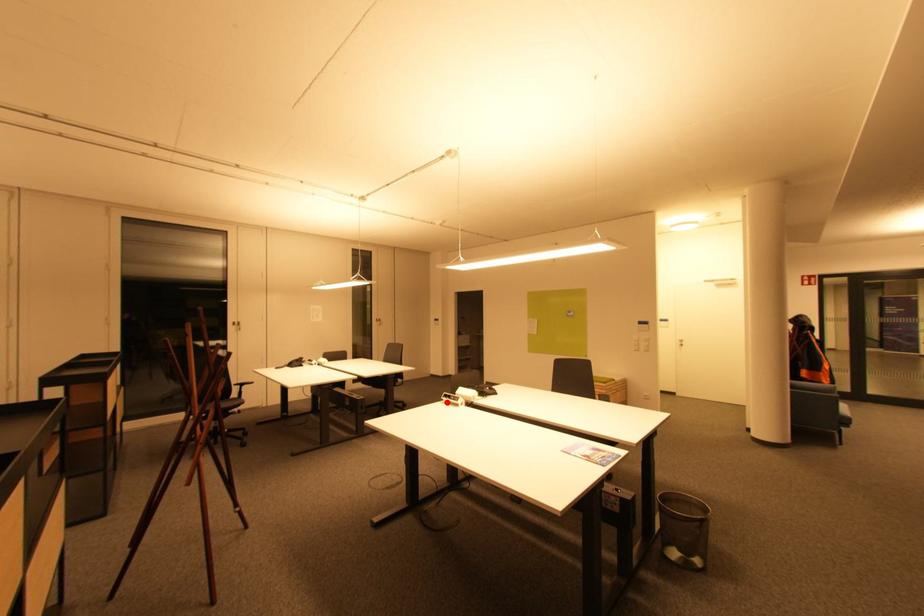
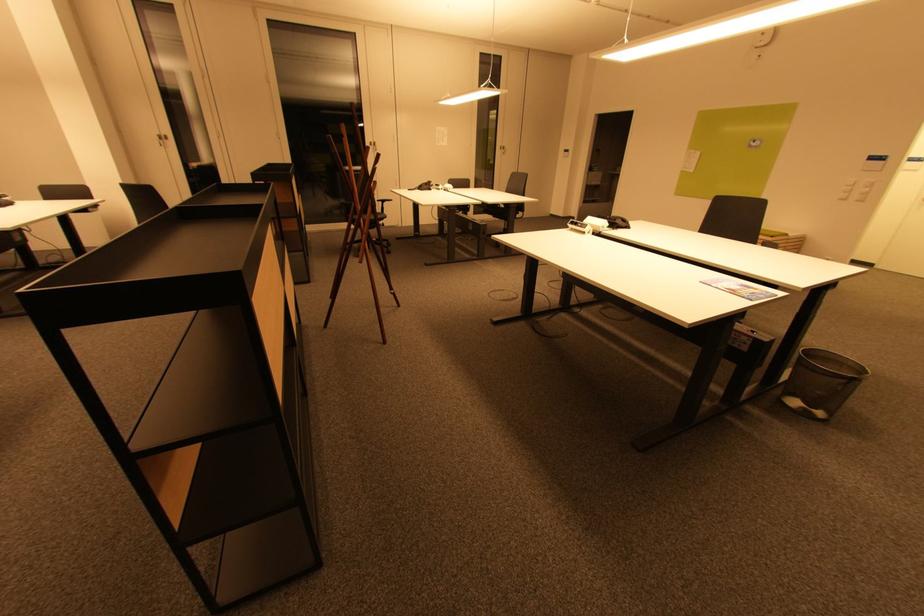
Question: I am providing you with two images of the same scene from different viewpoints. A red point is shown in image1. For the corresponding object point in image2, is it positioned nearer or farther from the camera?

Choices:
 (A) Nearer
 (B) Farther

Answer: (B)